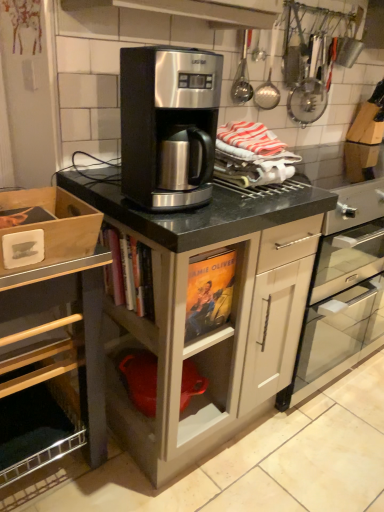
Question: Can you see wooden box at left, placed as the 1th cabinetry when sorted from left to right, touching matte black coffee maker at center, marked as the 1th cabinetry in a right-to-left arrangement?

Choices:
 (A) yes
 (B) no

Answer: (B)

Question: Can you confirm if wooden box at left, marked as the second cabinetry in a right-to-left arrangement, is positioned to the left of matte black coffee maker at center, marked as the 1th cabinetry in a right-to-left arrangement?

Choices:
 (A) no
 (B) yes

Answer: (B)

Question: Does wooden box at left, marked as the second cabinetry in a right-to-left arrangement, turn towards matte black coffee maker at center, marked as the 1th cabinetry in a right-to-left arrangement?

Choices:
 (A) yes
 (B) no

Answer: (B)

Question: Does wooden box at left, marked as the second cabinetry in a right-to-left arrangement, have a smaller size compared to matte black coffee maker at center, marked as the 1th cabinetry in a right-to-left arrangement?

Choices:
 (A) yes
 (B) no

Answer: (A)

Question: Is wooden box at left, marked as the second cabinetry in a right-to-left arrangement, turned away from matte black coffee maker at center, marked as the 1th cabinetry in a right-to-left arrangement?

Choices:
 (A) yes
 (B) no

Answer: (B)

Question: Is wooden box at left, marked as the second cabinetry in a right-to-left arrangement, taller than matte black coffee maker at center, marked as the 1th cabinetry in a right-to-left arrangement?

Choices:
 (A) no
 (B) yes

Answer: (A)

Question: Does wooden box at left, marked as the second cabinetry in a right-to-left arrangement, turn towards satin black coffee maker at center?

Choices:
 (A) yes
 (B) no

Answer: (B)

Question: Can you confirm if wooden box at left, marked as the second cabinetry in a right-to-left arrangement, is taller than satin black coffee maker at center?

Choices:
 (A) no
 (B) yes

Answer: (B)

Question: Is wooden box at left, placed as the 1th cabinetry when sorted from left to right, to the right of satin black coffee maker at center from the viewer's perspective?

Choices:
 (A) no
 (B) yes

Answer: (A)

Question: From a real-world perspective, is wooden box at left, marked as the second cabinetry in a right-to-left arrangement, physically below satin black coffee maker at center?

Choices:
 (A) no
 (B) yes

Answer: (B)

Question: Is there a large distance between wooden box at left, placed as the 1th cabinetry when sorted from left to right, and satin black coffee maker at center?

Choices:
 (A) no
 (B) yes

Answer: (A)

Question: Is wooden box at left, placed as the 1th cabinetry when sorted from left to right, shorter than satin black coffee maker at center?

Choices:
 (A) yes
 (B) no

Answer: (B)

Question: Is stainless steel coffee maker at center shorter than matte black coffee maker at center, marked as the 1th cabinetry in a right-to-left arrangement?

Choices:
 (A) no
 (B) yes

Answer: (B)